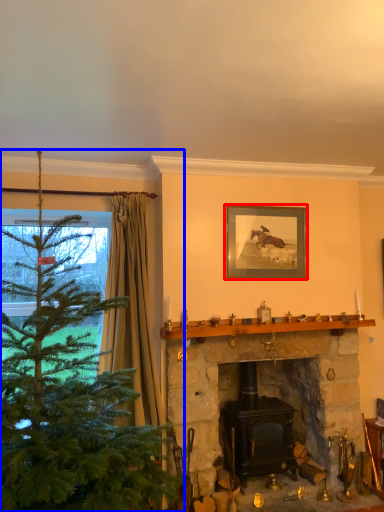
Question: Among these objects, which one is nearest to the camera, picture frame (highlighted by a red box) or christmas tree (highlighted by a blue box)?

Choices:
 (A) picture frame
 (B) christmas tree

Answer: (B)